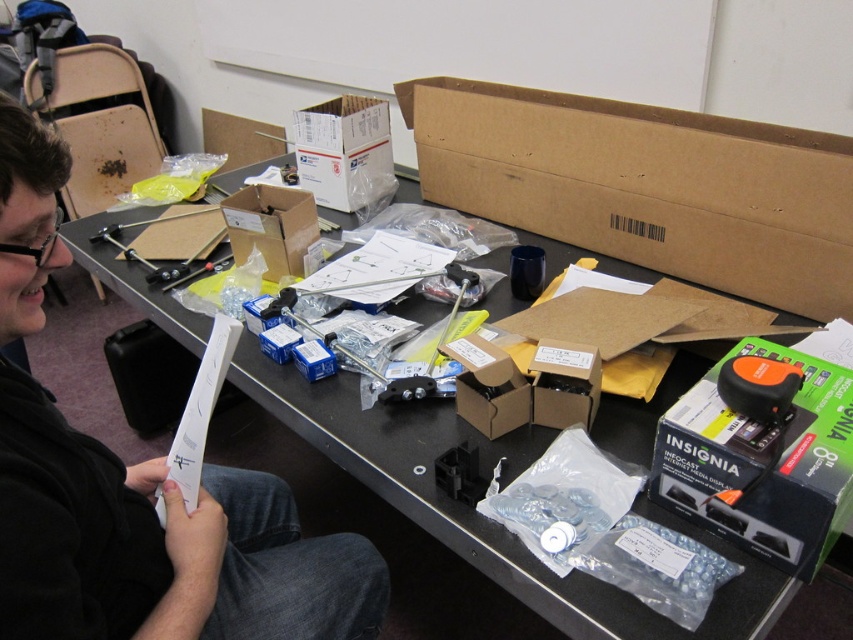
You are standing at the camera position looking at the workspace. There is a point marked at coordinates (16, 401) on the table. If you want to place a tool exactly at that point, how far in inches would you need to reach?

The point at coordinates (16, 401) is 28.33 inches away from the camera, so you would need to reach 28.33 inches to place the tool there.